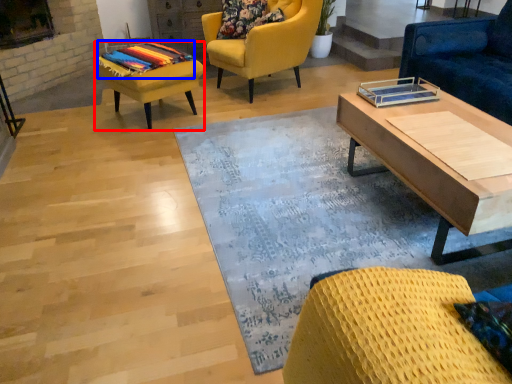
Question: Which object is closer to the camera taking this photo, stool (highlighted by a red box) or blanket (highlighted by a blue box)?

Choices:
 (A) stool
 (B) blanket

Answer: (A)